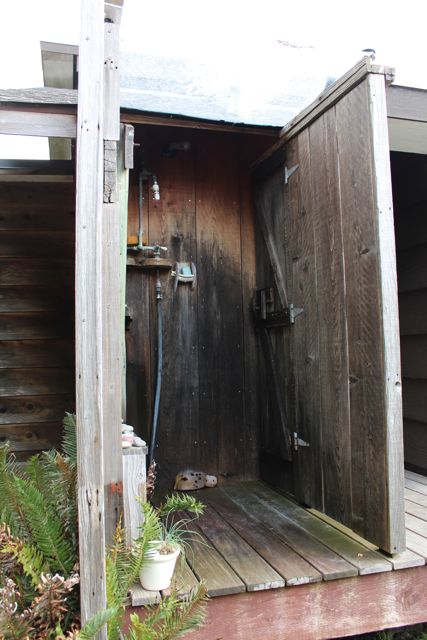
Identify the location of wood plank. The width and height of the screenshot is (427, 640). (268, 568).